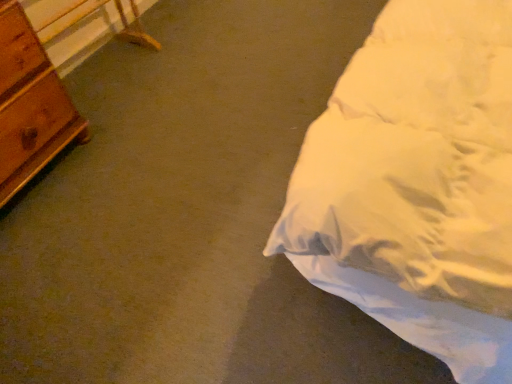
Question: Should I look upward or downward to see wooden table at left?

Choices:
 (A) down
 (B) up

Answer: (B)

Question: Can you confirm if wooden table at left is smaller than wooden chest of drawers at left?

Choices:
 (A) yes
 (B) no

Answer: (A)

Question: Considering the relative positions of wooden table at left and wooden chest of drawers at left in the image provided, is wooden table at left behind wooden chest of drawers at left?

Choices:
 (A) yes
 (B) no

Answer: (A)

Question: Is wooden table at left at the right side of wooden chest of drawers at left?

Choices:
 (A) yes
 (B) no

Answer: (A)

Question: From the image's perspective, is wooden table at left over wooden chest of drawers at left?

Choices:
 (A) no
 (B) yes

Answer: (B)

Question: Is wooden table at left oriented away from wooden chest of drawers at left?

Choices:
 (A) no
 (B) yes

Answer: (A)

Question: Does wooden table at left have a lesser height compared to wooden chest of drawers at left?

Choices:
 (A) yes
 (B) no

Answer: (A)

Question: Is wooden chest of drawers at left thinner than wooden table at left?

Choices:
 (A) no
 (B) yes

Answer: (A)

Question: From the image's perspective, is wooden chest of drawers at left above wooden table at left?

Choices:
 (A) no
 (B) yes

Answer: (A)

Question: Is wooden chest of drawers at left wider than wooden table at left?

Choices:
 (A) yes
 (B) no

Answer: (A)

Question: From the image's perspective, is wooden chest of drawers at left below wooden table at left?

Choices:
 (A) no
 (B) yes

Answer: (B)

Question: Does wooden chest of drawers at left have a lesser height compared to wooden table at left?

Choices:
 (A) yes
 (B) no

Answer: (B)

Question: Is wooden chest of drawers at left closer to camera compared to wooden table at left?

Choices:
 (A) yes
 (B) no

Answer: (A)

Question: From a real-world perspective, relative to wooden table at left, is wooden chest of drawers at left vertically above or below?

Choices:
 (A) below
 (B) above

Answer: (B)